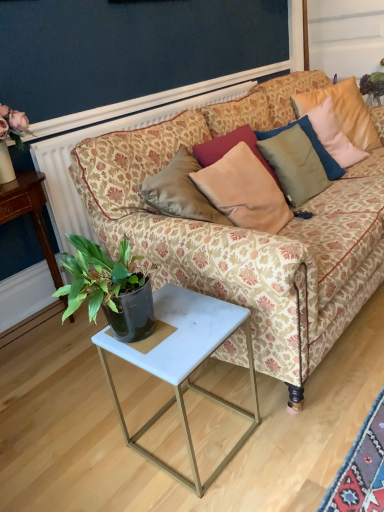
Where is `spots to the right of white marble side table at lower center`? The width and height of the screenshot is (384, 512). spots to the right of white marble side table at lower center is located at coordinates (298, 434).